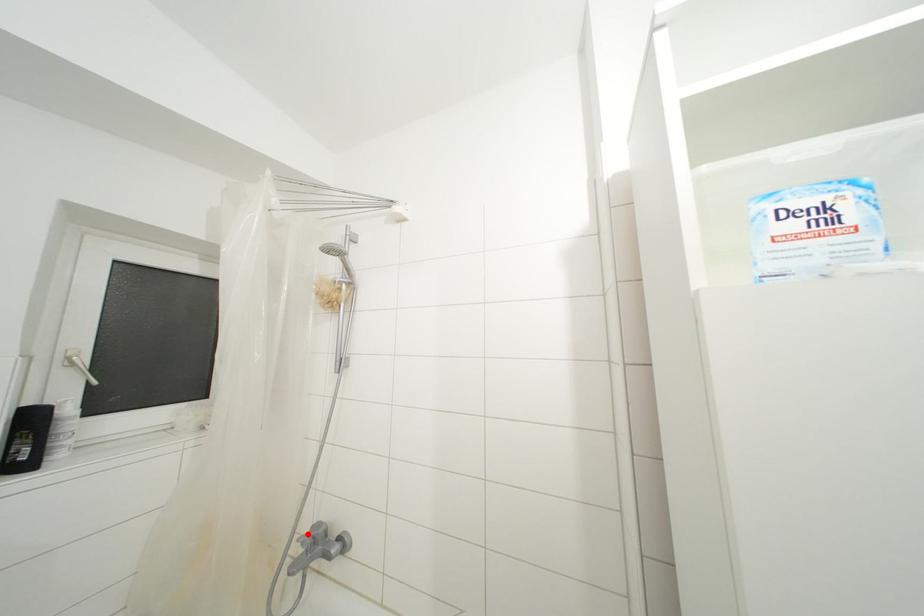
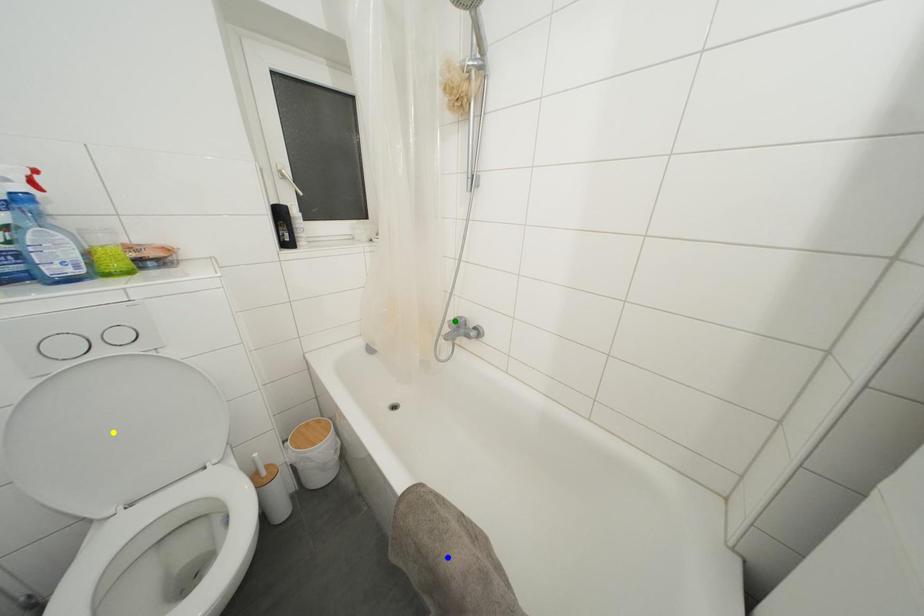
Question: I am providing you with two images of the same scene from different viewpoints. A red point is marked on the first image. You are given multiple points on the second image. In image 2, which mark is for the same physical point as the one in image 1?

Choices:
 (A) blue point
 (B) yellow point
 (C) green point

Answer: (C)